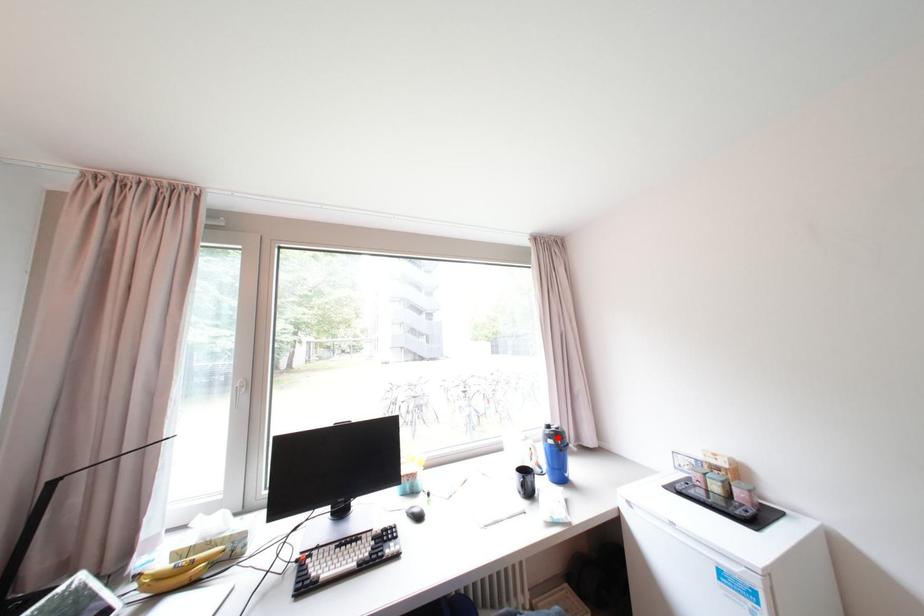
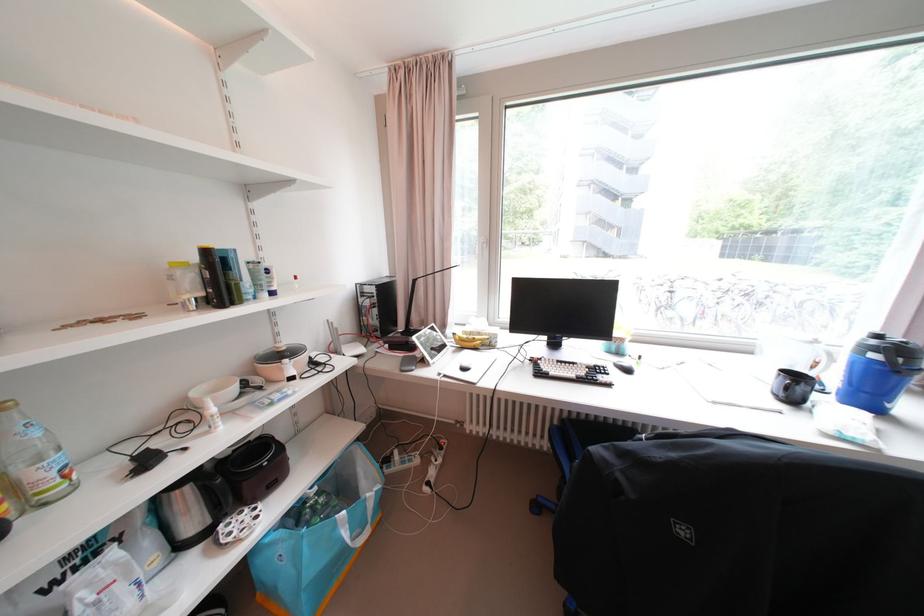
Question: I am providing you with two images of the same scene from different viewpoints. A red point is marked on the first image. Is the red point's position out of view in image 2?

Choices:
 (A) Yes
 (B) No

Answer: (B)